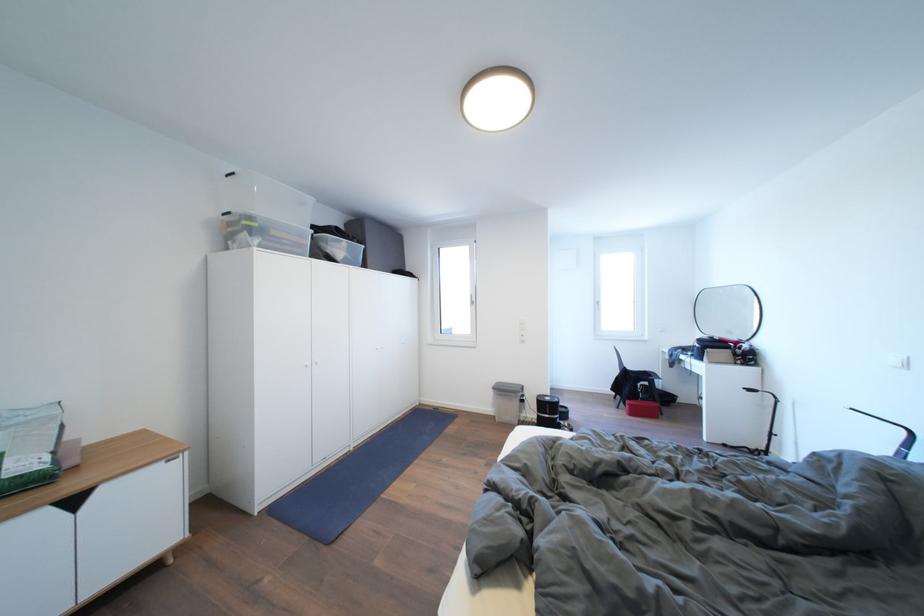
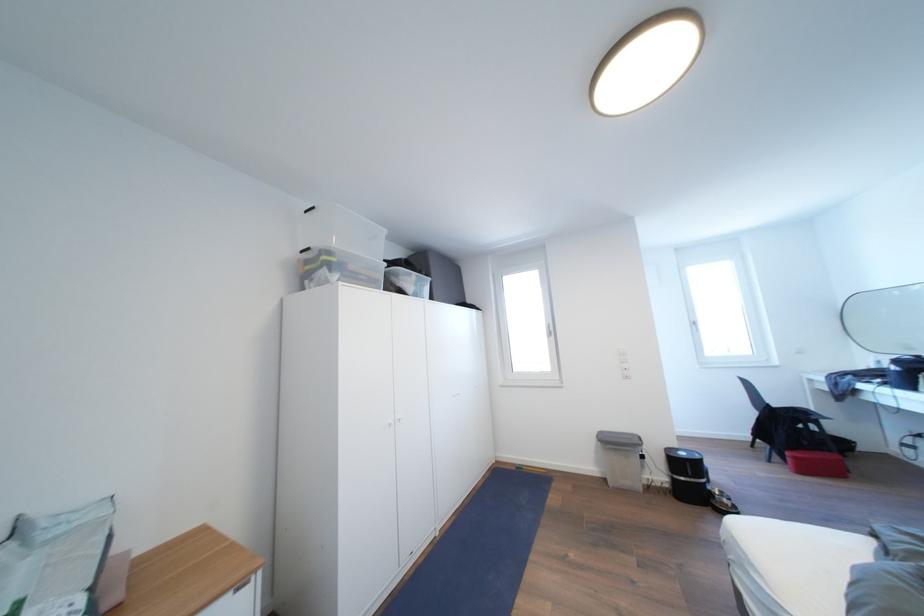
In the second image, find the point that corresponds to point (638, 410) in the first image.

(803, 463)